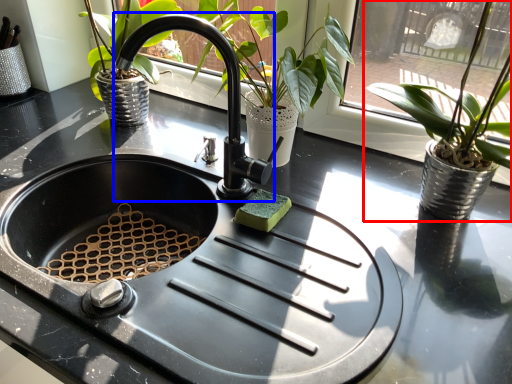
Question: Which object is further to the camera taking this photo, houseplant (highlighted by a red box) or faucet (highlighted by a blue box)?

Choices:
 (A) houseplant
 (B) faucet

Answer: (B)